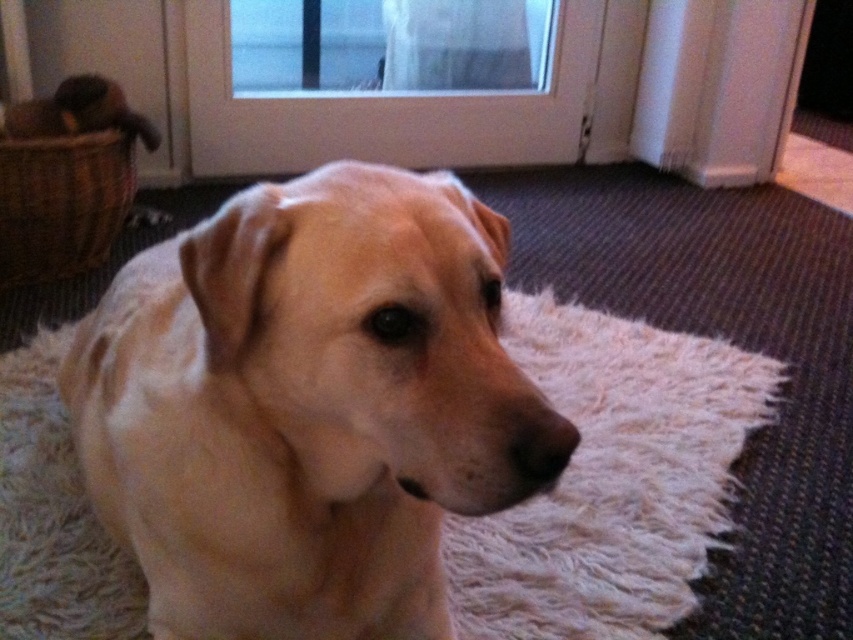
Does transparent glass door at upper center have a greater height compared to woven brown basket at left?

In fact, transparent glass door at upper center may be shorter than woven brown basket at left.

Is point (334, 54) farther from camera compared to point (67, 188)?

That is True.

The height and width of the screenshot is (640, 853). I want to click on transparent glass door at upper center, so point(389,44).

Who is higher up, light beige fur dog at center or transparent glass door at upper center?

transparent glass door at upper center

Does light beige fur dog at center come in front of transparent glass door at upper center?

That is True.

Is point (155, 339) less distant than point (387, 90)?

Yes, point (155, 339) is in front of point (387, 90).

You are a GUI agent. You are given a task and a screenshot of the screen. Output one action in this format:
    pyautogui.click(x=<x>, y=<y>)
    Task: Click on the light beige fur dog at center
    The width and height of the screenshot is (853, 640).
    Given the screenshot: What is the action you would take?
    pos(308,406)

Who is higher up, light beige fur dog at center or woven brown basket at left?

woven brown basket at left

I want to click on light beige fur dog at center, so click(x=308, y=406).